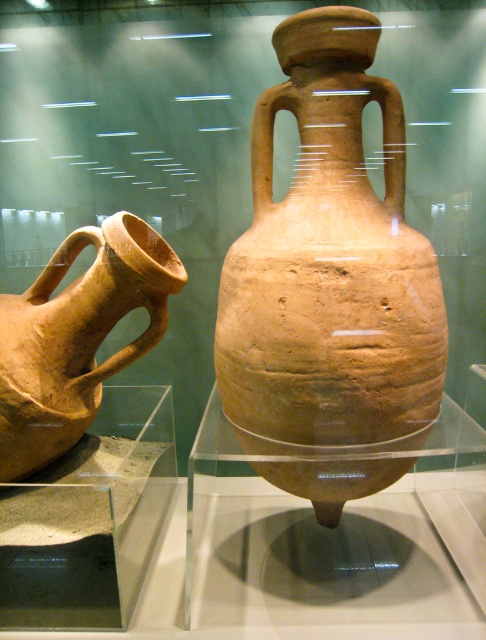
You are a visitor in the museum and want to take a photo of the brown matte amphora at center. The museum allows photos only if the object is not obstructed by other items. Are there any objects blocking your view of the brown matte amphora at center at point (329,266)?

The brown matte amphora at center is located at point (329,266), and there are no other objects mentioned in the scene that could obstruct its view. Therefore, you can take the photo without any obstruction.

In the scene shown: You are a museum visitor standing in front of a display case containing the brown matte amphora at center. The museum requires that visitors maintain a minimum distance of 5 feet from all artifacts for preservation. Are you currently violating this rule?

The brown matte amphora at center is only 4.69 feet away from the viewer, which is less than the required 5 feet. Therefore, you are violating the museum rule and should step back to maintain the appropriate distance.